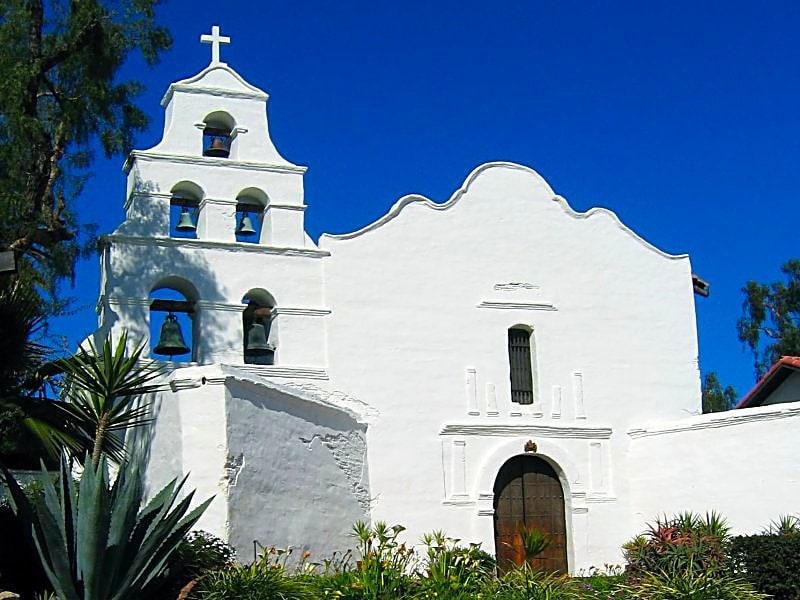
You are a GUI agent. You are given a task and a screenshot of the screen. Output one action in this format:
    pyautogui.click(x=<x>, y=<y>)
    Task: Click on the bar window
    
    Given the screenshot: What is the action you would take?
    pyautogui.click(x=521, y=368)